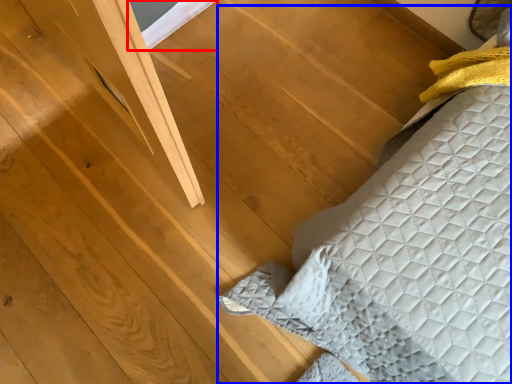
Question: Which point is further to the camera, window (highlighted by a red box) or furniture (highlighted by a blue box)?

Choices:
 (A) window
 (B) furniture

Answer: (A)